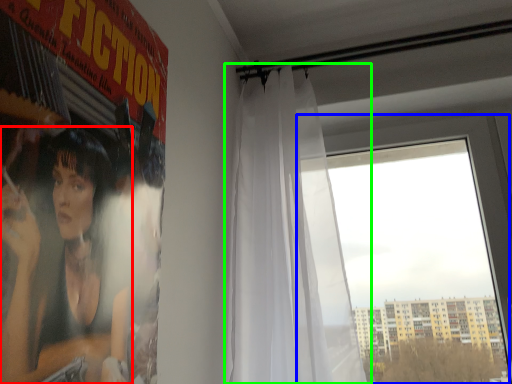
Question: Estimate the real-world distances between objects in this image. Which object is farther from person (highlighted by a red box), window (highlighted by a blue box) or curtain (highlighted by a green box)?

Choices:
 (A) window
 (B) curtain

Answer: (A)